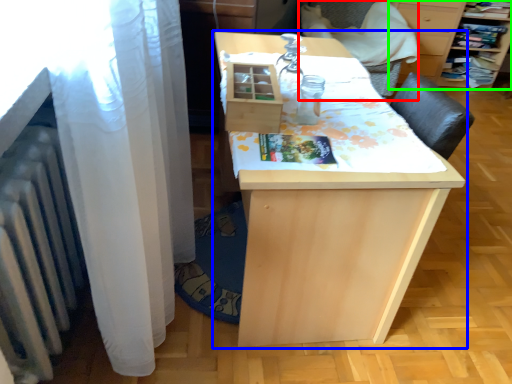
Question: Estimate the real-world distances between objects in this image. Which object is closer to armchair (highlighted by a red box), table (highlighted by a blue box) or furniture (highlighted by a green box)?

Choices:
 (A) table
 (B) furniture

Answer: (B)